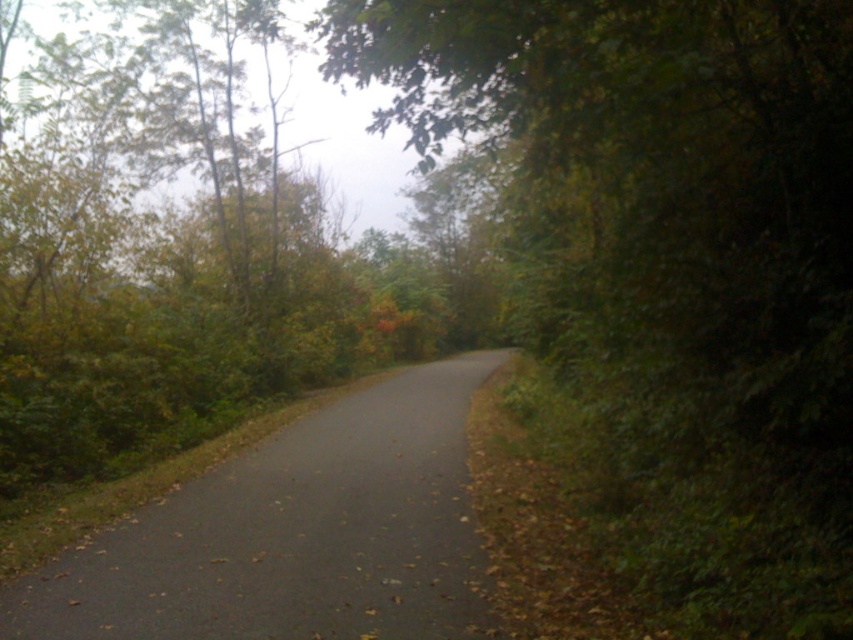
You are driving a car that is 4 meters long. You see the green leafy tree at center in front of you. Can you safely stop your car before hitting the tree?

The green leafy tree at center is 4.07 meters away from viewer. Since your car is 4 meters long, you have just enough space to stop before hitting the tree, but it would be very close. It is advisable to brake gently to ensure safety.

You are standing at the starting point of the road and want to reach the green leafy tree at center. Which direction should you walk to get there?

You should walk forward along the road since the green leafy tree at center is located at point [670,260], which is ahead on the road from your starting position.

You are driving a car that is 2 meters wide. You come across a narrow section of the road where the black asphalt road at center is flanked by the green leafy tree at center. Can your car safely pass through this section without hitting the tree?

The distance between the green leafy tree at center and the black asphalt road at center is 3.58 meters. Since the car is 2 meters wide, there is sufficient space for it to pass safely without hitting the tree.